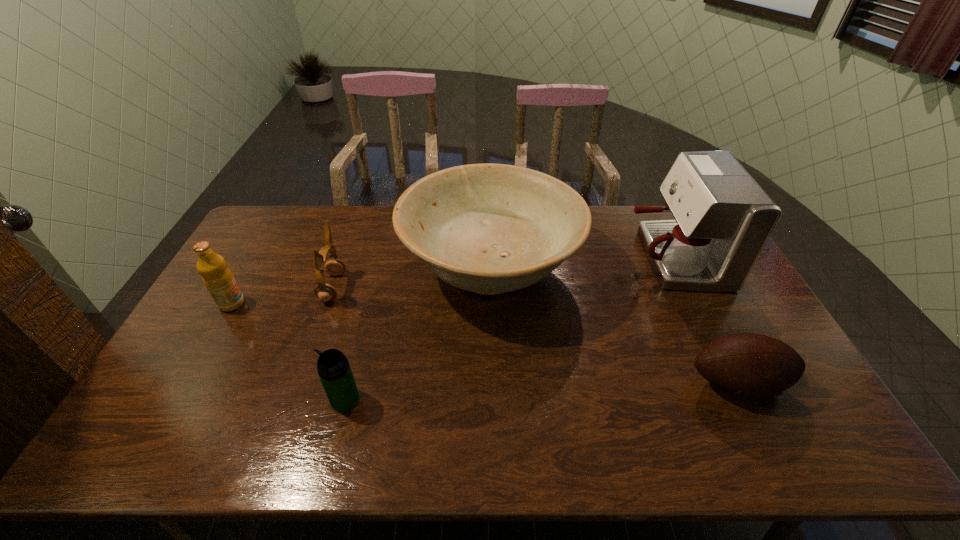
Find the location of `coffee maker`. coffee maker is located at coordinates (723, 219).

This screenshot has width=960, height=540. In order to click on dish in this screenshot , I will do `click(488, 228)`.

Where is `the leftmost object`? The width and height of the screenshot is (960, 540). the leftmost object is located at coordinates (217, 277).

You are a GUI agent. You are given a task and a screenshot of the screen. Output one action in this format:
    pyautogui.click(x=<x>, y=<y>)
    Task: Click on the fifth object from right to left
    Image resolution: width=960 pixels, height=540 pixels.
    Given the screenshot: What is the action you would take?
    pyautogui.click(x=325, y=292)

This screenshot has width=960, height=540. I want to click on the third object from left to right, so click(x=334, y=370).

The image size is (960, 540). Find the location of `football`. football is located at coordinates (754, 365).

At what (x,y) coordinates should I click in order to perform the action: click on free point located 0.170m on the front of the coffee maker near the spout. Please return your answer as a coordinate pair (x, y). Looking at the image, I should click on (579, 258).

You are a GUI agent. You are given a task and a screenshot of the screen. Output one action in this format:
    pyautogui.click(x=<x>, y=<y>)
    Task: Click on the vacant point located 0.180m on the front of the coffee maker near the spout
    Image resolution: width=960 pixels, height=540 pixels.
    Given the screenshot: What is the action you would take?
    pyautogui.click(x=576, y=258)

Where is `vacant space located on the front of the coffee maker near the spout`? The image size is (960, 540). vacant space located on the front of the coffee maker near the spout is located at coordinates (559, 258).

At what (x,y) coordinates should I click in order to perform the action: click on vacant space located on the front of the dish. Please return your answer as a coordinate pair (x, y). Looking at the image, I should click on (492, 352).